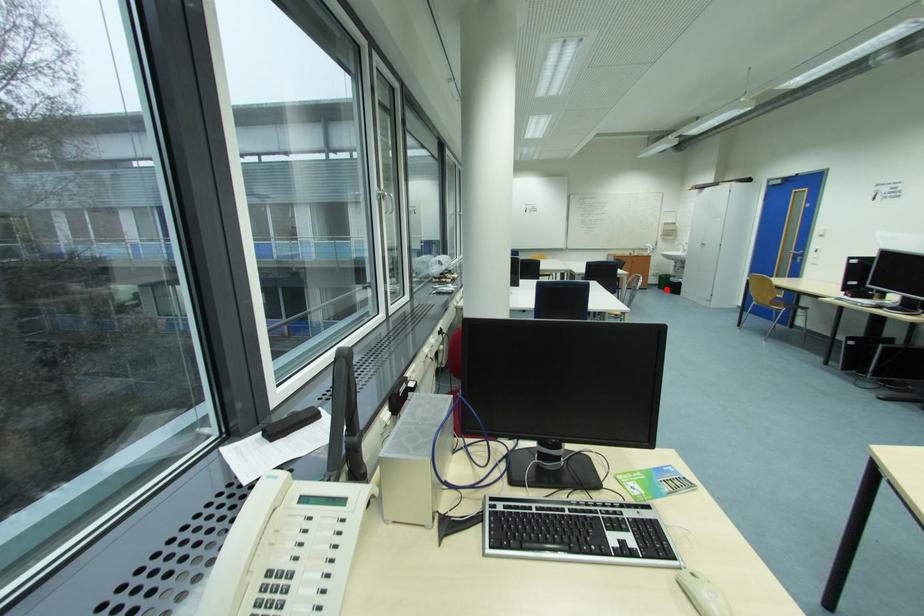
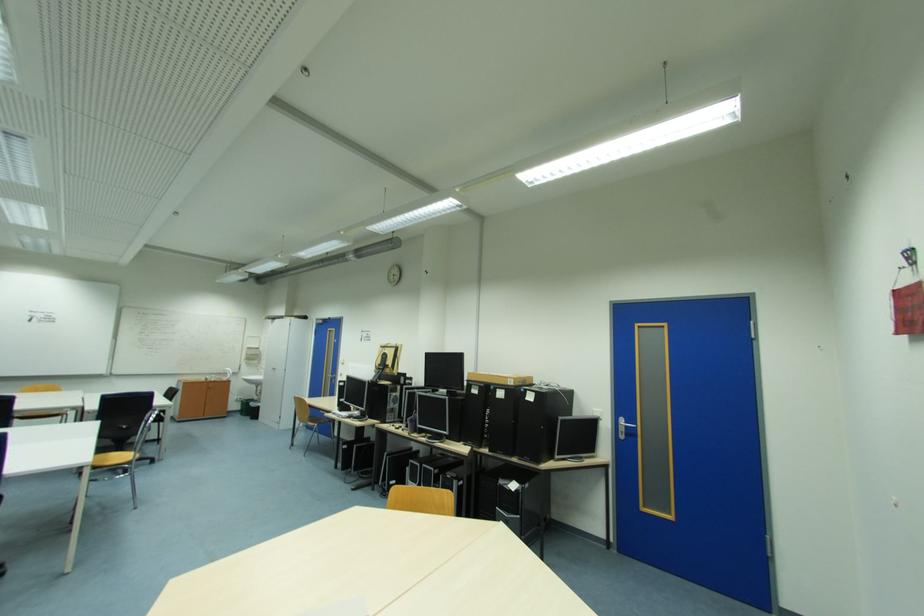
Locate, in the second image, the point that corresponds to the highlighted location in the first image.

(249, 416)